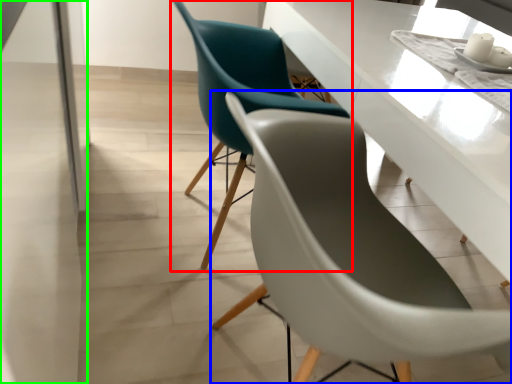
Question: Which is nearer to the chair (highlighted by a red box)? chair (highlighted by a blue box) or glass door (highlighted by a green box).

Choices:
 (A) chair
 (B) glass door

Answer: (A)